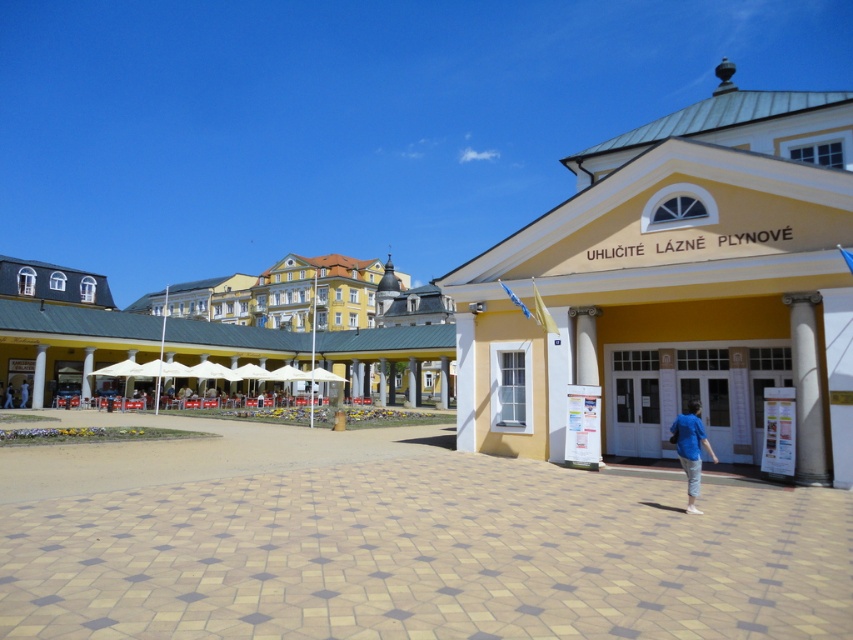
Question: Is white marble column at right in front of light blue shirt at lower left?

Choices:
 (A) yes
 (B) no

Answer: (A)

Question: Which of these objects is positioned farthest from the blue cotton shirt at center?

Choices:
 (A) white marble column at right
 (B) light blue shirt at lower left

Answer: (B)

Question: Which of these objects is positioned farthest from the light blue shirt at lower left?

Choices:
 (A) white marble column at right
 (B) blue cotton shirt at center

Answer: (A)

Question: Which object is the farthest from the blue cotton shirt at center?

Choices:
 (A) white marble column at right
 (B) light blue shirt at lower left

Answer: (B)

Question: Is white marble column at right positioned behind blue cotton shirt at center?

Choices:
 (A) no
 (B) yes

Answer: (B)

Question: Does white marble column at right come behind blue cotton shirt at center?

Choices:
 (A) yes
 (B) no

Answer: (A)